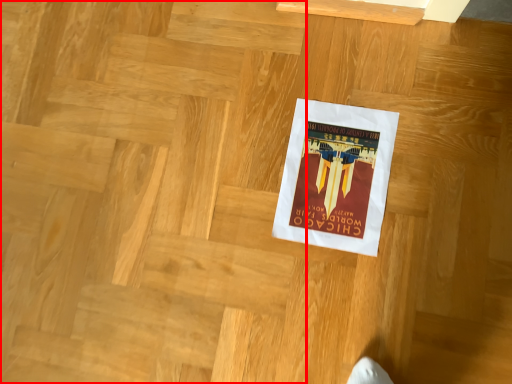
Question: Where is stairwell (annotated by the red box) located in relation to poster in the image?

Choices:
 (A) right
 (B) left

Answer: (B)